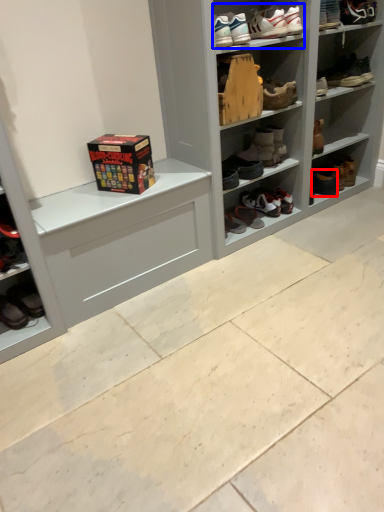
Question: Which of the following is the farthest to the observer, footwear (highlighted by a red box) or footwear (highlighted by a blue box)?

Choices:
 (A) footwear
 (B) footwear

Answer: (A)